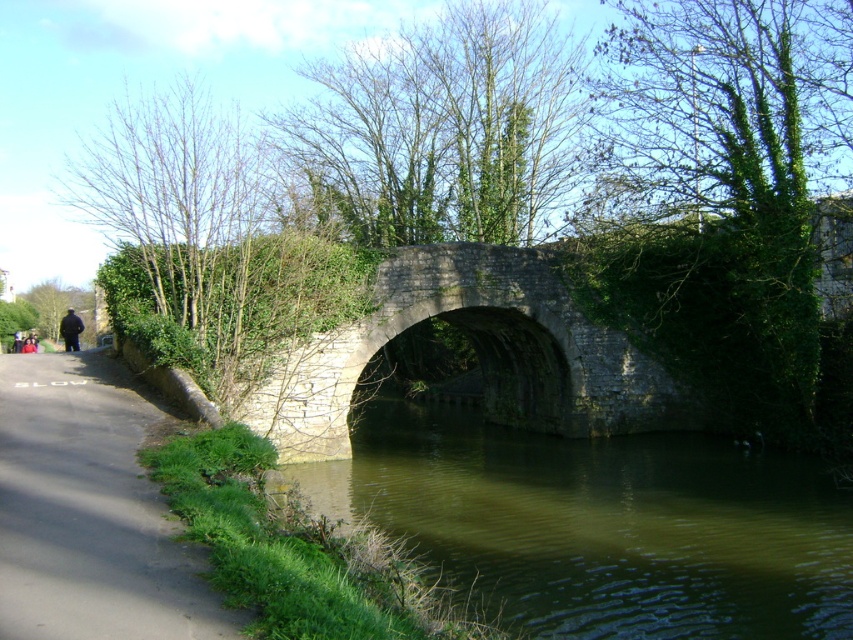
You are standing on the stone bridge and see the greenish murky water at center and the dark gray fabric jacket at left. Which object is located to the right of the other?

The greenish murky water at center is located to the right of the dark gray fabric jacket at left.

You are standing at the point marked as point (x=44, y=605) in the image. A friend is standing exactly where you are viewing from. How far apart are you and your friend?

You and your friend are 5.08 meters apart because the distance between point (x=44, y=605) and the viewer is 5.08 meters.

You are a tourist standing on the gray stone bridge at center. You see the greenish murky water at center below you. Can you confirm if the water is directly underneath the bridge?

Yes, the greenish murky water at center is directly below the gray stone bridge at center, so the water is indeed underneath the bridge.